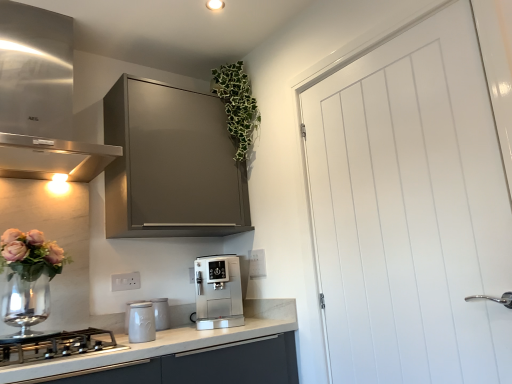
Question: Considering the relative positions of green leafy plant at upper center and white smooth door at right in the image provided, is green leafy plant at upper center to the left of white smooth door at right from the viewer's perspective?

Choices:
 (A) no
 (B) yes

Answer: (B)

Question: Would you say white smooth door at right is part of green leafy plant at upper center's contents?

Choices:
 (A) no
 (B) yes

Answer: (A)

Question: Is green leafy plant at upper center bigger than white smooth door at right?

Choices:
 (A) yes
 (B) no

Answer: (B)

Question: From the image's perspective, would you say green leafy plant at upper center is shown under white smooth door at right?

Choices:
 (A) no
 (B) yes

Answer: (A)

Question: Is the position of green leafy plant at upper center more distant than that of white smooth door at right?

Choices:
 (A) yes
 (B) no

Answer: (A)

Question: Is green leafy plant at upper center directly adjacent to white smooth door at right?

Choices:
 (A) no
 (B) yes

Answer: (A)

Question: From the image's perspective, would you say white ceramic jar at lower left, positioned as the 2th kitchen appliance in right-to-left order, is positioned over matte gray cabinet at upper center?

Choices:
 (A) no
 (B) yes

Answer: (A)

Question: Considering the relative sizes of white ceramic jar at lower left, arranged as the third kitchen appliance when viewed from the left, and matte gray cabinet at upper center in the image provided, is white ceramic jar at lower left, arranged as the third kitchen appliance when viewed from the left, shorter than matte gray cabinet at upper center?

Choices:
 (A) yes
 (B) no

Answer: (A)

Question: Can you confirm if white ceramic jar at lower left, positioned as the 2th kitchen appliance in right-to-left order, is smaller than matte gray cabinet at upper center?

Choices:
 (A) yes
 (B) no

Answer: (A)

Question: Are white ceramic jar at lower left, arranged as the third kitchen appliance when viewed from the left, and matte gray cabinet at upper center beside each other?

Choices:
 (A) no
 (B) yes

Answer: (A)

Question: Is white ceramic jar at lower left, arranged as the third kitchen appliance when viewed from the left, looking in the opposite direction of matte gray cabinet at upper center?

Choices:
 (A) yes
 (B) no

Answer: (B)

Question: Is white ceramic jar at lower left, arranged as the third kitchen appliance when viewed from the left, positioned far away from matte gray cabinet at upper center?

Choices:
 (A) yes
 (B) no

Answer: (B)

Question: Is matte gray cabinet at upper center wider than satin silver coffee machine at center, placed as the fourth kitchen appliance when sorted from left to right?

Choices:
 (A) yes
 (B) no

Answer: (B)